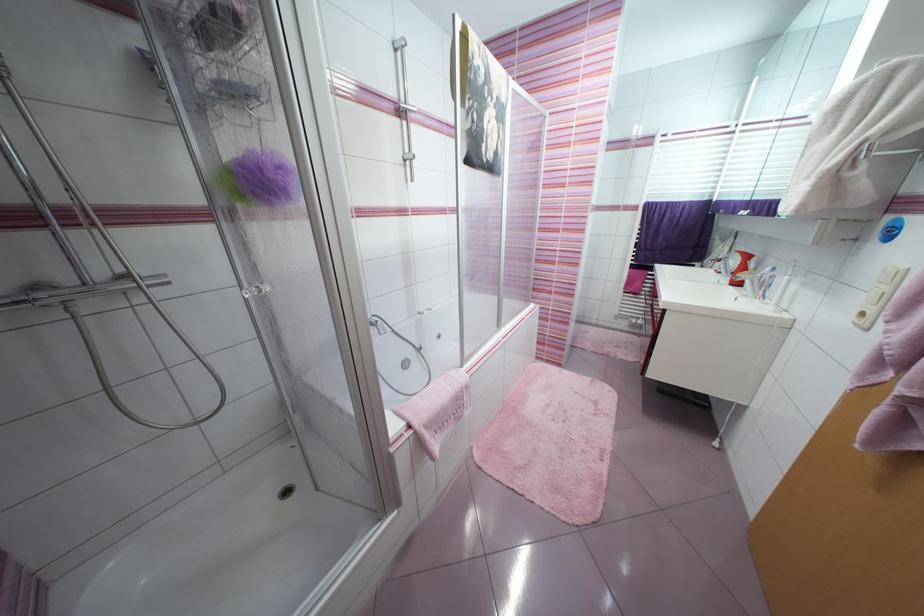
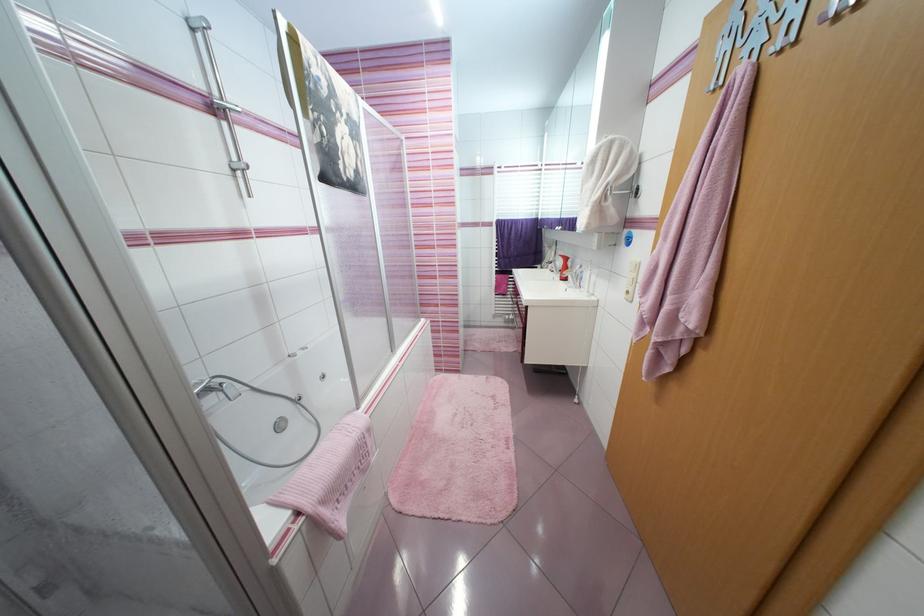
In the second image, find the point that corresponds to point 417,158 in the first image.

(249, 167)